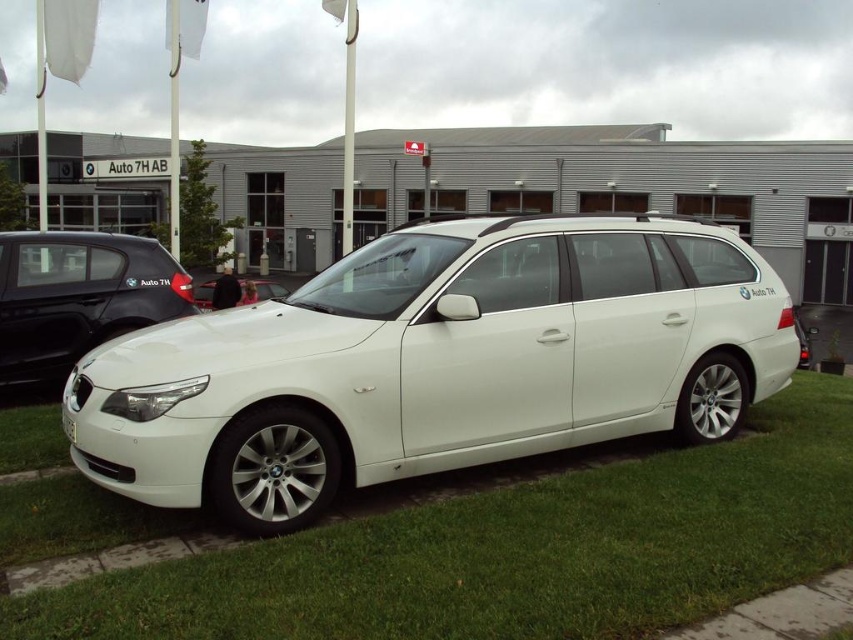
You are standing at the point closest to the car in the image. Which of the two points, point [32,234] or point [242,280], is closer to you?

Point [32,234] is closer to you because it is in front of point [242,280].

You are standing in front of the white metallic car at left and want to step onto the green grass at lower center. In which direction should you move relative to the car?

You should move to the right relative to the white metallic car at left because the green grass at lower center is located to its right side.

You are a customer at the Auto 7H AB dealership and want to take a closer look at both the white metallic car at left and the white matte car at center. Since you are standing in front of the building, which car should you walk towards first to avoid being blocked by the other?

You should walk towards the white metallic car at left first because it is positioned under the white matte car at center, meaning it is closer to you. Once you move past it, you can then approach the white matte car at center without obstruction.